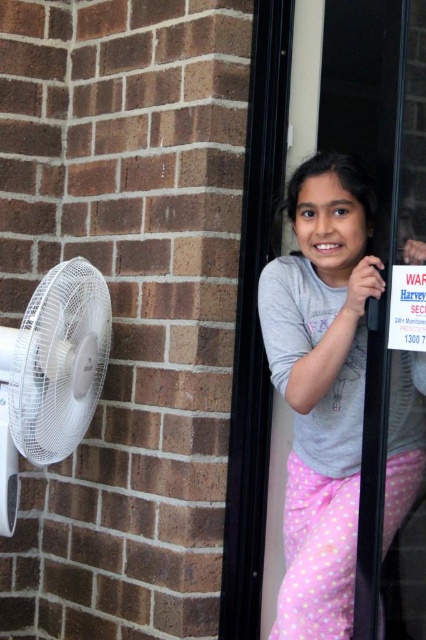
Question: Is gray cotton shirt at upper right wider than white paper sign at upper right?

Choices:
 (A) no
 (B) yes

Answer: (B)

Question: Considering the real-world distances, which object is farthest from the white plastic fan at left?

Choices:
 (A) white paper sign at upper right
 (B) gray cotton shirt at upper right

Answer: (A)

Question: Does gray cotton shirt at upper right appear on the left side of white plastic fan at left?

Choices:
 (A) no
 (B) yes

Answer: (A)

Question: Which object is the farthest from the white paper sign at upper right?

Choices:
 (A) white plastic fan at left
 (B) gray cotton shirt at upper right

Answer: (A)

Question: From the image, what is the correct spatial relationship of white plastic fan at left in relation to white paper sign at upper right?

Choices:
 (A) left
 (B) right

Answer: (A)

Question: Among these points, which one is farthest from the camera?

Choices:
 (A) (0, 385)
 (B) (288, 472)
 (C) (403, 276)

Answer: (B)